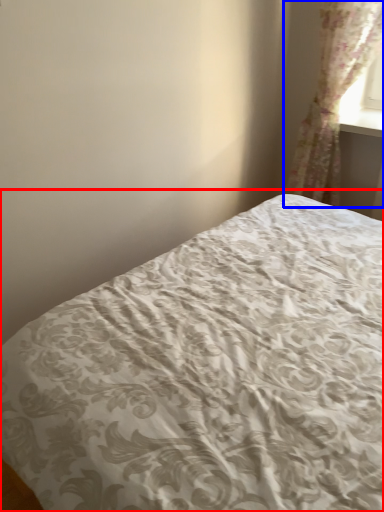
Question: Which object appears farthest to the camera in this image, bed (highlighted by a red box) or curtain (highlighted by a blue box)?

Choices:
 (A) bed
 (B) curtain

Answer: (B)